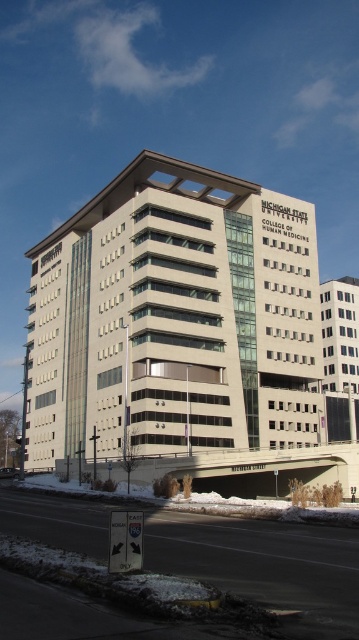
You are standing at the entrance of the Michigan State University College of Human Medicine building and notice two points marked on the facade. The first point is located at coordinates point (101, 529) and the second at point (152, 500). From your vantage point, which point appears closer to you?

Point (101, 529) is in front of point (152, 500), so it appears closer to you.